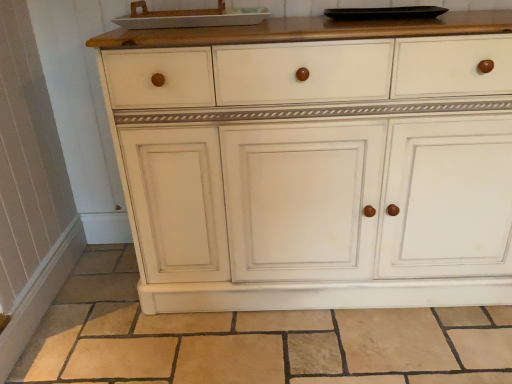
Question: From the image's perspective, is white painted wood cabinet at center located above or below white glossy tray at upper center?

Choices:
 (A) above
 (B) below

Answer: (B)

Question: Is white painted wood cabinet at center wider or thinner than white glossy tray at upper center?

Choices:
 (A) wide
 (B) thin

Answer: (A)

Question: Estimate the real-world distances between objects in this image. Which object is closer to the white glossy tray at upper center?

Choices:
 (A) white painted wood cabinet at center
 (B) beige tile at lower center

Answer: (A)

Question: Which object is positioned closest to the beige tile at lower center?

Choices:
 (A) white glossy tray at upper center
 (B) white painted wood cabinet at center

Answer: (B)